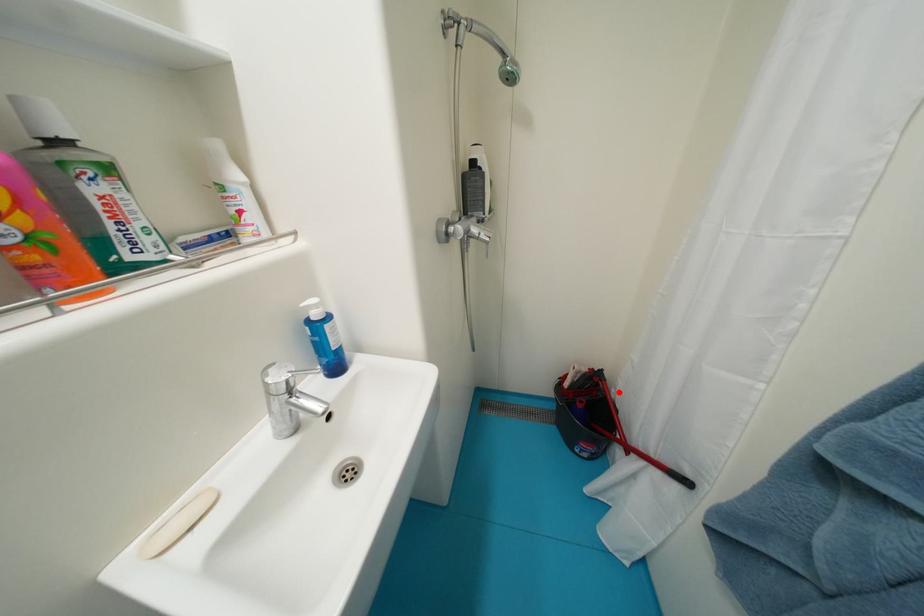
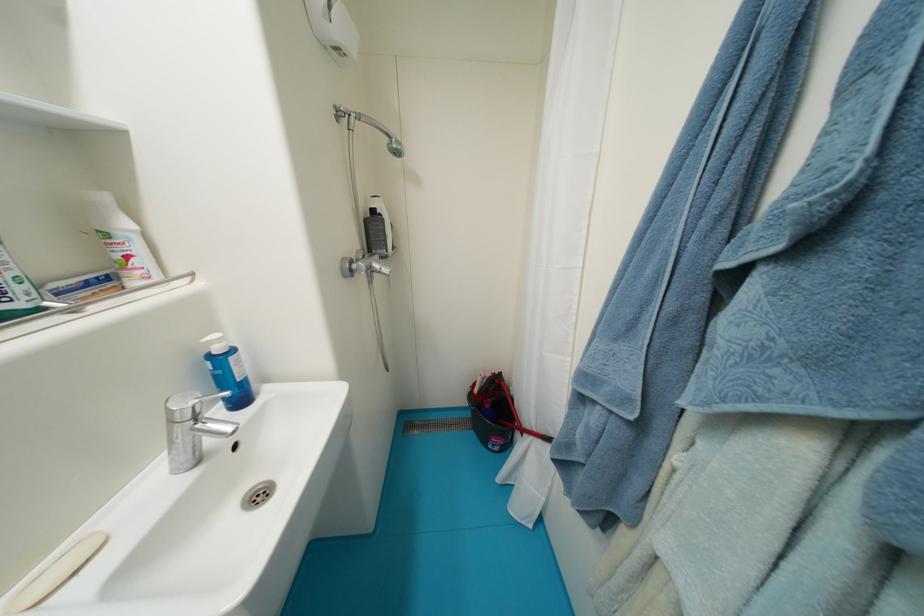
The point at the highlighted location is marked in the first image. Where is the corresponding point in the second image?

(517, 390)